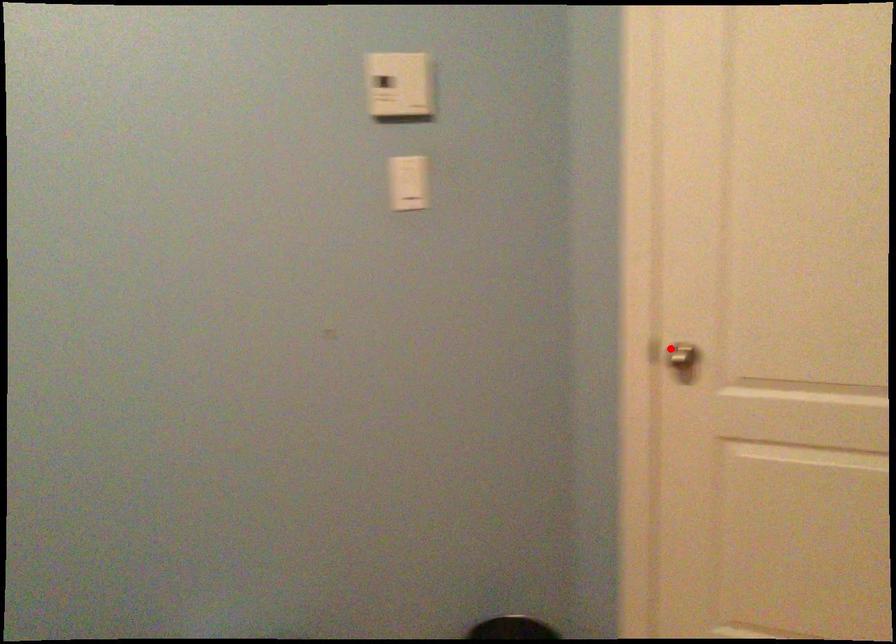
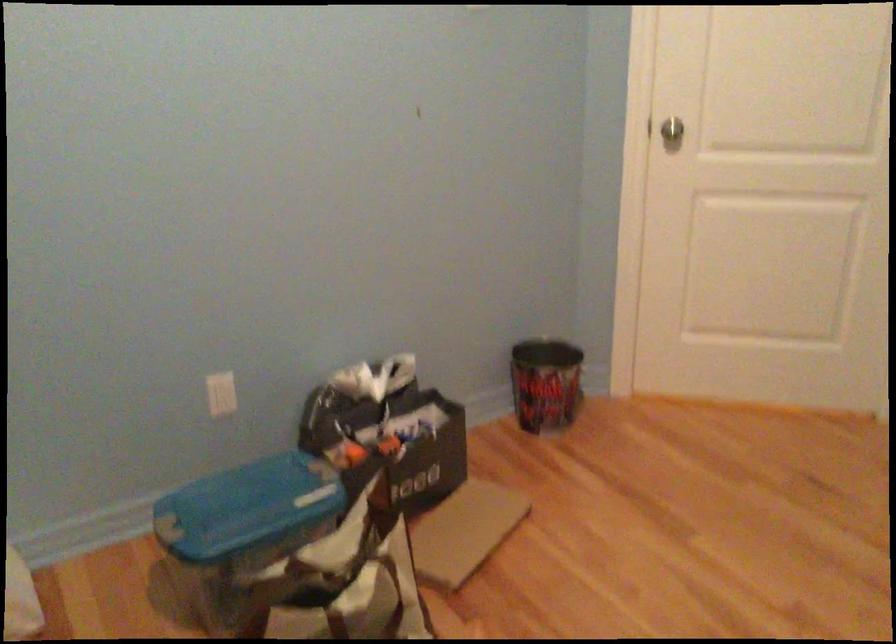
Question: I am providing you with two images of the same scene from different viewpoints. Image1 has a red point marked. In image2, the corresponding 3D location appears at what relative position? Reply with the corresponding letter.

Choices:
 (A) Closer
 (B) Farther

Answer: (B)